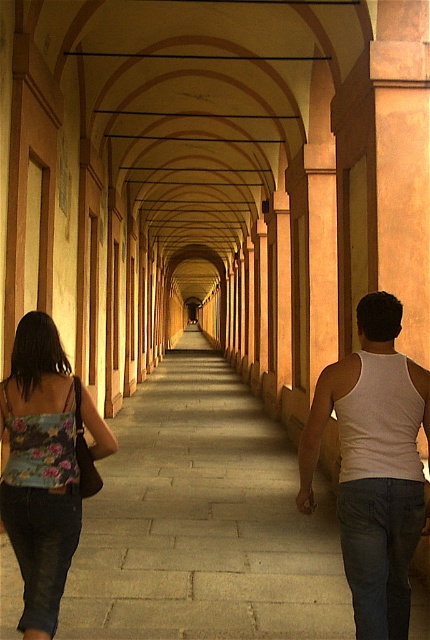
You are standing at the entrance of the walkway and want to place a small potted plant between the gray stone pavement at center and the white tank top at center. Considering their heights, which object should the plant be placed closer to?

The gray stone pavement at center has a lesser height compared to the white tank top at center, so the plant should be placed closer to the gray stone pavement at center to ensure stability and visibility.

You are standing at the entrance of the walkway and see both the white tank top at center and the floral fabric tank top at lower left. Which person is closer to you?

The white tank top at center is closer to you because it is further to the viewer than the floral fabric tank top at lower left.

In the scene shown: You are standing at the entrance of the walkway and see two points marked in the scene. The first point is at coordinate point (325, 596) and the second is at point (365, 490). If you were to walk along the walkway towards the shadowed area, which point would you encounter first?

Point (365, 490) would be encountered first because it is in front of point (325, 596) according to the spatial description provided.